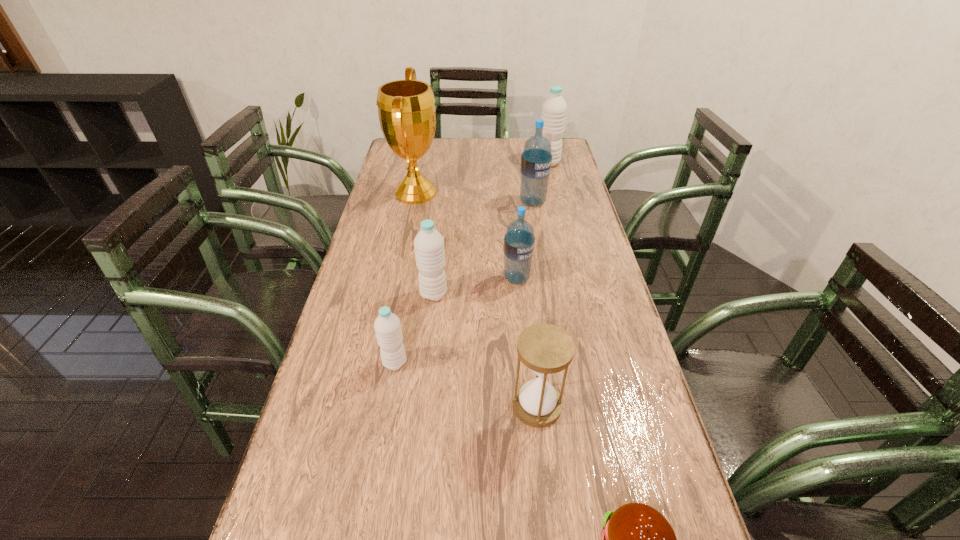
Find the location of `hourglass`. hourglass is located at coordinates coord(546,349).

Locate an element on the screen. the smallest white water bottle is located at coordinates (387, 326).

Locate an element on the screen. The width and height of the screenshot is (960, 540). the shortest water bottle is located at coordinates (387, 326).

The image size is (960, 540). What are the coordinates of `vacant area situated on the front-facing side of the tallest object` in the screenshot? It's located at 495,193.

Identify the location of vacant space located on the left of the biggest white water bottle. The height and width of the screenshot is (540, 960). (453, 163).

Locate an element on the screen. free space located 0.280m on the back of the bigger blue water bottle is located at coordinates (525, 159).

You are a GUI agent. You are given a task and a screenshot of the screen. Output one action in this format:
    pyautogui.click(x=<x>, y=<y>)
    Task: Click on the vacant space situated on the left of the smaller blue water bottle
    Image resolution: width=960 pixels, height=540 pixels.
    Given the screenshot: What is the action you would take?
    pyautogui.click(x=450, y=279)

Where is `vacant space located 0.100m on the back of the fourth water bottle from right to left`? The image size is (960, 540). vacant space located 0.100m on the back of the fourth water bottle from right to left is located at coordinates tap(438, 262).

Image resolution: width=960 pixels, height=540 pixels. Find the location of `free space located on the back of the seventh farthest object`. free space located on the back of the seventh farthest object is located at coordinates (526, 303).

Identify the location of free space located 0.220m on the back of the third nearest object. (408, 291).